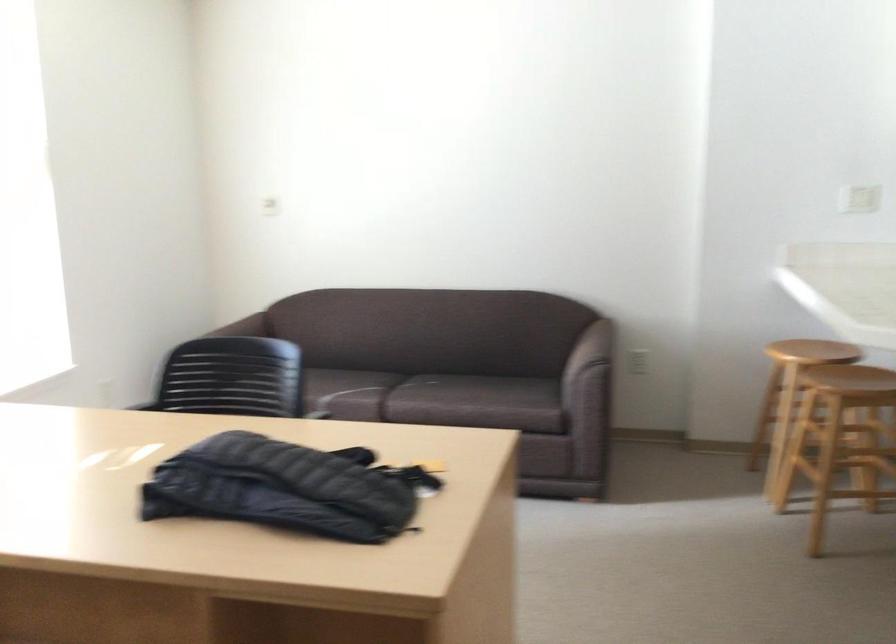
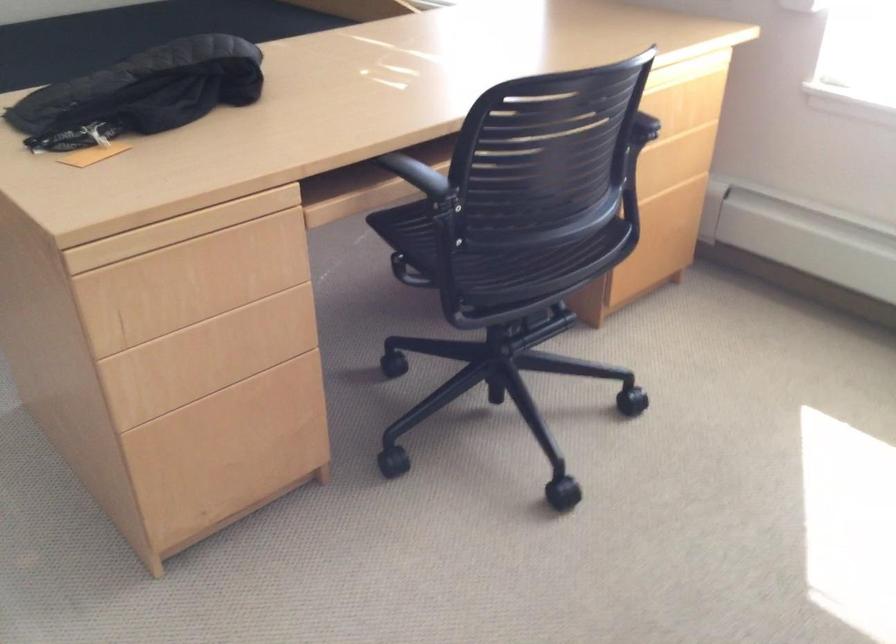
Locate, in the second image, the point that corresponds to point (437, 450) in the first image.

(179, 229)